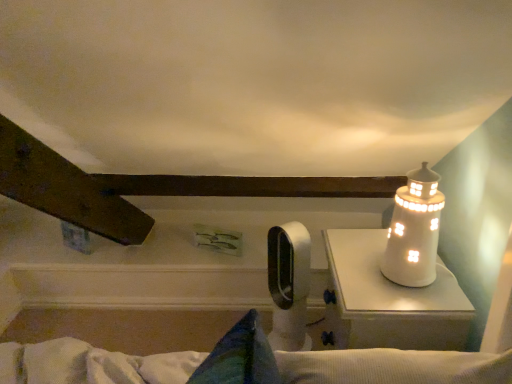
Locate an element on the screen. white ceramic lighthouse at upper right is located at coordinates (414, 230).

What do you see at coordinates (289, 284) in the screenshot? This screenshot has height=384, width=512. I see `white plastic fan at center` at bounding box center [289, 284].

Locate an element on the screen. white ceramic lighthouse at upper right is located at coordinates (414, 230).

Considering the relative sizes of white glossy lighthouse at right and white plastic fan at center in the image provided, is white glossy lighthouse at right shorter than white plastic fan at center?

Correct, white glossy lighthouse at right is not as tall as white plastic fan at center.

Are white glossy lighthouse at right and white plastic fan at center making contact?

No, white glossy lighthouse at right is not in contact with white plastic fan at center.

Is point (464, 321) farther from viewer compared to point (291, 254)?

No, it is in front of (291, 254).

Considering the sizes of white plastic fan at center and white ceramic lighthouse at upper right in the image, is white plastic fan at center bigger or smaller than white ceramic lighthouse at upper right?

white plastic fan at center is bigger than white ceramic lighthouse at upper right.

From a real-world perspective, is white plastic fan at center located beneath white ceramic lighthouse at upper right?

Yes, from a real-world perspective, white plastic fan at center is beneath white ceramic lighthouse at upper right.

Which is correct: white plastic fan at center is inside white ceramic lighthouse at upper right, or outside of it?

white plastic fan at center is located beyond the bounds of white ceramic lighthouse at upper right.

Does point (404, 278) come in front of point (287, 301)?

That is True.

Where is `lamp above the white plastic fan at center (from a real-world perspective)`? The image size is (512, 384). lamp above the white plastic fan at center (from a real-world perspective) is located at coordinates (414, 230).

How many degrees apart are the facing directions of white ceramic lighthouse at upper right and white plastic fan at center?

The angular difference between white ceramic lighthouse at upper right and white plastic fan at center is 40 degrees.

Is white plastic fan at center at the back of white ceramic lighthouse at upper right?

No, white ceramic lighthouse at upper right is not facing the opposite direction of white plastic fan at center.

Considering the positions of objects white ceramic lighthouse at upper right and white glossy lighthouse at right in the image provided, who is behind, white ceramic lighthouse at upper right or white glossy lighthouse at right?

white glossy lighthouse at right is more distant.

From the image's perspective, is white ceramic lighthouse at upper right above or below white glossy lighthouse at right?

From the image's perspective, white ceramic lighthouse at upper right appears above white glossy lighthouse at right.

Does point (431, 250) come in front of point (444, 272)?

Yes.

From a real-world perspective, who is located lower, white plastic fan at center or white glossy lighthouse at right?

From a 3D spatial view, white plastic fan at center is below.

From the image's perspective, does white plastic fan at center appear lower than white glossy lighthouse at right?

Incorrect, from the image's perspective, white plastic fan at center is higher than white glossy lighthouse at right.

Identify the location of table that appears below the white plastic fan at center (from the image's perspective). The width and height of the screenshot is (512, 384). (393, 298).

Is white plastic fan at center positioned far away from white glossy lighthouse at right?

white plastic fan at center is actually quite close to white glossy lighthouse at right.

From a real-world perspective, relative to white ceramic lighthouse at upper right, is white glossy lighthouse at right vertically above or below?

From a real-world perspective, white glossy lighthouse at right is physically below white ceramic lighthouse at upper right.

Is white glossy lighthouse at right spatially inside white ceramic lighthouse at upper right, or outside of it?

white glossy lighthouse at right lies outside white ceramic lighthouse at upper right.

Relative to white ceramic lighthouse at upper right, is white glossy lighthouse at right in front or behind?

white glossy lighthouse at right is behind white ceramic lighthouse at upper right.

Find the location of a particular element. equipment that is on the left side of white glossy lighthouse at right is located at coordinates (289, 284).

You are a GUI agent. You are given a task and a screenshot of the screen. Output one action in this format:
    pyautogui.click(x=<x>, y=<y>)
    Task: Click on the lamp positioned vertically above the white plastic fan at center (from a real-world perspective)
    
    Given the screenshot: What is the action you would take?
    pyautogui.click(x=414, y=230)

Estimate the real-world distances between objects in this image. Which object is further from white plastic fan at center, white glossy lighthouse at right or white ceramic lighthouse at upper right?

Based on the image, white ceramic lighthouse at upper right appears to be further to white plastic fan at center.

Estimate the real-world distances between objects in this image. Which object is further from white ceramic lighthouse at upper right, white plastic fan at center or white glossy lighthouse at right?

white plastic fan at center is further to white ceramic lighthouse at upper right.

Considering their positions, is white plastic fan at center positioned further to white glossy lighthouse at right than white ceramic lighthouse at upper right?

white plastic fan at center is further to white glossy lighthouse at right.

From the picture: Estimate the real-world distances between objects in this image. Which object is closer to white plastic fan at center, white ceramic lighthouse at upper right or white glossy lighthouse at right?

Based on the image, white glossy lighthouse at right appears to be nearer to white plastic fan at center.

From the image, which object appears to be nearer to white ceramic lighthouse at upper right, white glossy lighthouse at right or white plastic fan at center?

white glossy lighthouse at right is positioned closer to the anchor white ceramic lighthouse at upper right.

Considering their positions, is white ceramic lighthouse at upper right positioned further to white glossy lighthouse at right than white plastic fan at center?

white plastic fan at center lies further to white glossy lighthouse at right than the other object.

The image size is (512, 384). I want to click on table positioned between white ceramic lighthouse at upper right and white plastic fan at center from near to far, so click(x=393, y=298).